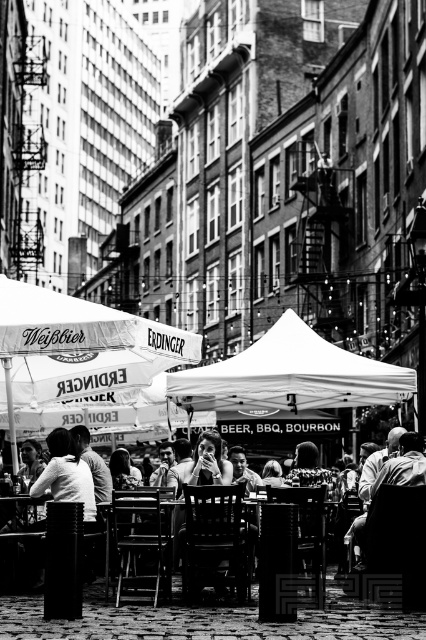
Question: Which object appears farthest from the camera in this image?

Choices:
 (A) white fabric canopy at center
 (B) dark hair at lower right

Answer: (A)

Question: Is white fabric canopy at center wider than dark hair at lower right?

Choices:
 (A) yes
 (B) no

Answer: (A)

Question: Can you confirm if white fabric canopy at center is positioned below dark hair at lower right?

Choices:
 (A) no
 (B) yes

Answer: (A)

Question: Can you confirm if white fabric canopy at center is wider than dark hair at lower right?

Choices:
 (A) yes
 (B) no

Answer: (A)

Question: Which of the following is the closest to the observer?

Choices:
 (A) dark hair at lower right
 (B) white fabric canopy at center

Answer: (A)

Question: Among these objects, which one is farthest from the camera?

Choices:
 (A) white fabric canopy at center
 (B) dark hair at lower right

Answer: (A)